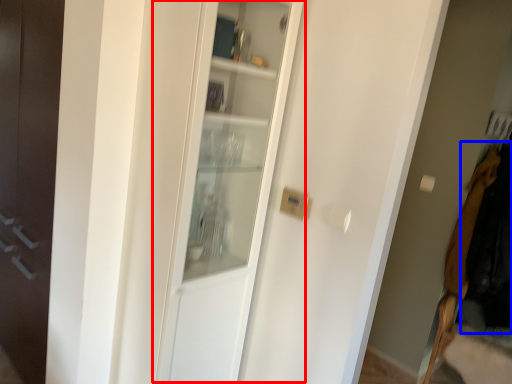
Question: Which object appears closest to the camera in this image, cabinetry (highlighted by a red box) or clothing (highlighted by a blue box)?

Choices:
 (A) cabinetry
 (B) clothing

Answer: (A)